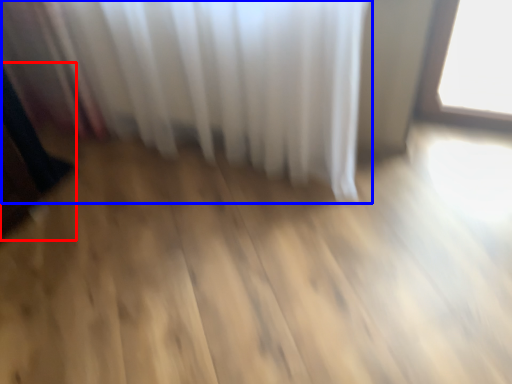
Question: Which object appears farthest to the camera in this image, dark (highlighted by a red box) or curtain (highlighted by a blue box)?

Choices:
 (A) dark
 (B) curtain

Answer: (A)